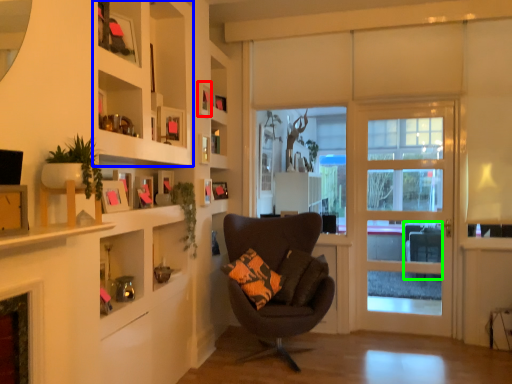
Question: Considering the real-world distances, which object is closest to picture frame (highlighted by a red box)? cabinet (highlighted by a blue box) or swivel chair (highlighted by a green box).

Choices:
 (A) cabinet
 (B) swivel chair

Answer: (A)